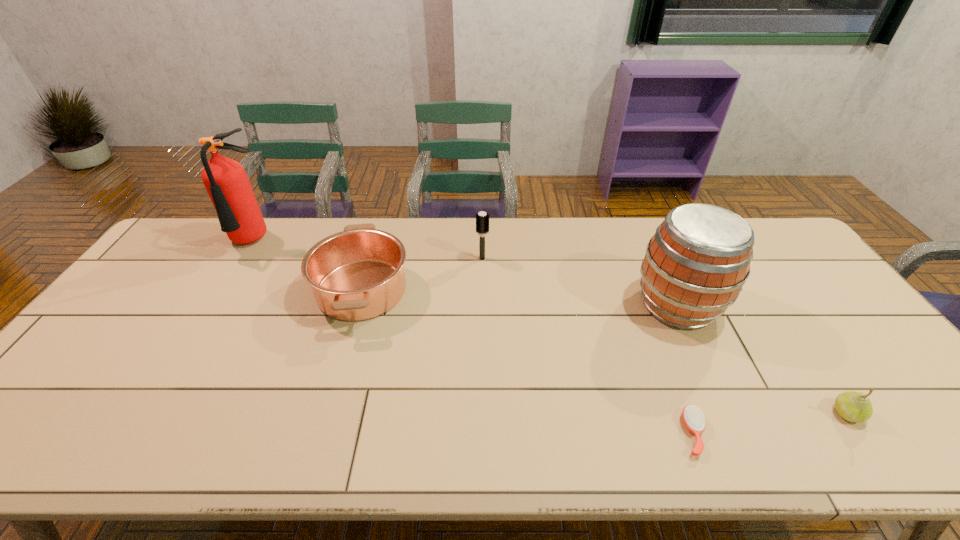
Where is `the tallest object`? The height and width of the screenshot is (540, 960). the tallest object is located at coordinates (226, 181).

The height and width of the screenshot is (540, 960). I want to click on the leftmost object, so click(x=226, y=181).

Find the location of a particular element. Image resolution: width=960 pixels, height=540 pixels. cider is located at coordinates (695, 265).

You are a GUI agent. You are given a task and a screenshot of the screen. Output one action in this format:
    pyautogui.click(x=<x>, y=<y>)
    Task: Click on the farther hairbrush
    Image resolution: width=960 pixels, height=540 pixels.
    Given the screenshot: What is the action you would take?
    pyautogui.click(x=482, y=219)

Where is `the left hairbrush`? This screenshot has height=540, width=960. the left hairbrush is located at coordinates (482, 219).

The width and height of the screenshot is (960, 540). What are the coordinates of `saucepan` in the screenshot? It's located at (357, 274).

What are the coordinates of `pear` in the screenshot? It's located at (853, 406).

The width and height of the screenshot is (960, 540). I want to click on the shortest object, so click(693, 418).

In order to click on the nearer hairbrush in this screenshot , I will do `click(693, 418)`.

The image size is (960, 540). Find the location of `vacant space located 0.220m at the nozzle of the tallest object`. vacant space located 0.220m at the nozzle of the tallest object is located at coordinates (212, 309).